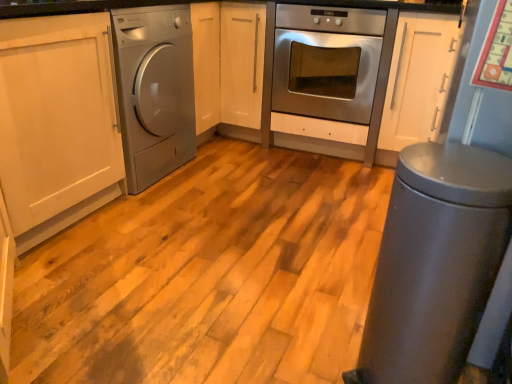
Image resolution: width=512 pixels, height=384 pixels. In order to click on white matte cabinet at center in this screenshot , I will do `click(228, 64)`.

Does metallic gray trash can at lower right turn towards white matte cabinet at center?

No, metallic gray trash can at lower right is not facing towards white matte cabinet at center.

Is metallic gray trash can at lower right far away from white matte cabinet at center?

metallic gray trash can at lower right is positioned a significant distance from white matte cabinet at center.

You are a GUI agent. You are given a task and a screenshot of the screen. Output one action in this format:
    pyautogui.click(x=<x>, y=<y>)
    Task: Click on the gray on the right of white matte cabinet at center
    Image resolution: width=512 pixels, height=384 pixels.
    Given the screenshot: What is the action you would take?
    pyautogui.click(x=435, y=263)

Which is more to the left, metallic gray trash can at lower right or white matte cabinet at center?

Positioned to the left is white matte cabinet at center.

Which of these two, stainless steel oven at center or satin silver washing machine at left, stands taller?

satin silver washing machine at left is taller.

Is point (365, 68) positioned after point (173, 156)?

No, it is in front of (173, 156).

Can you tell me how much stainless steel oven at center and satin silver washing machine at left differ in facing direction?

90.6 degrees.

Does white matte cabinet at center lie in front of stainless steel oven at center?

No, the depth of white matte cabinet at center is greater than that of stainless steel oven at center.

Could you tell me if white matte cabinet at center is turned towards stainless steel oven at center?

No, white matte cabinet at center is not aimed at stainless steel oven at center.

Who is smaller, white matte cabinet at center or stainless steel oven at center?

With smaller size is stainless steel oven at center.

At what (x,y) coordinates should I click in order to perform the action: click on gray in front of the stainless steel oven at center. Please return your answer as a coordinate pair (x, y). The height and width of the screenshot is (384, 512). Looking at the image, I should click on (435, 263).

Which is more to the left, metallic gray trash can at lower right or stainless steel oven at center?

metallic gray trash can at lower right is more to the left.

Is the position of metallic gray trash can at lower right more distant than that of stainless steel oven at center?

No, metallic gray trash can at lower right is in front of stainless steel oven at center.

From a real-world perspective, is satin silver washing machine at left located higher than stainless steel oven at center?

Yes, from a real-world perspective, satin silver washing machine at left is on top of stainless steel oven at center.

Who is more distant, satin silver washing machine at left or stainless steel oven at center?

satin silver washing machine at left is behind.

Is point (181, 23) more distant than point (366, 18)?

That is False.

Between satin silver washing machine at left and stainless steel oven at center, which one has more height?

With more height is satin silver washing machine at left.

Could you tell me if stainless steel oven at center is facing metallic gray trash can at lower right?

Yes, stainless steel oven at center faces towards metallic gray trash can at lower right.

Which is further, (381, 47) or (394, 285)?

The point (381, 47) is farther from the camera.

Where is `oven behind the metallic gray trash can at lower right`? The image size is (512, 384). oven behind the metallic gray trash can at lower right is located at coordinates (326, 62).

At what (x,y) coordinates should I click in order to perform the action: click on cabinetry that appears on the right of satin silver washing machine at left. Please return your answer as a coordinate pair (x, y). Image resolution: width=512 pixels, height=384 pixels. Looking at the image, I should click on (228, 64).

From a real-world perspective, who is located higher, white matte cabinet at center or satin silver washing machine at left?

From a 3D spatial view, white matte cabinet at center is above.

Is white matte cabinet at center next to satin silver washing machine at left?

No, white matte cabinet at center is not with satin silver washing machine at left.

Between white matte cabinet at center and satin silver washing machine at left, which one has larger size?

white matte cabinet at center is bigger.

Locate an element on the screen. cabinetry located on the left of metallic gray trash can at lower right is located at coordinates (228, 64).

Locate an element on the screen. This screenshot has width=512, height=384. oven that is below the satin silver washing machine at left (from the image's perspective) is located at coordinates (326, 62).

Considering their positions, is white matte cabinet at center positioned closer to satin silver washing machine at left than metallic gray trash can at lower right?

white matte cabinet at center is positioned closer to the anchor satin silver washing machine at left.

Considering their positions, is satin silver washing machine at left positioned closer to stainless steel oven at center than metallic gray trash can at lower right?

Answer: Based on the image, satin silver washing machine at left appears to be nearer to stainless steel oven at center.

Looking at the image, which one is located further to stainless steel oven at center, metallic gray trash can at lower right or satin silver washing machine at left?

Based on the image, metallic gray trash can at lower right appears to be further to stainless steel oven at center.

Considering their positions, is metallic gray trash can at lower right positioned closer to satin silver washing machine at left than white matte cabinet at center?

white matte cabinet at center.

Consider the image. When comparing their distances from white matte cabinet at center, does metallic gray trash can at lower right or satin silver washing machine at left seem further?

metallic gray trash can at lower right lies further to white matte cabinet at center than the other object.

Estimate the real-world distances between objects in this image. Which object is closer to satin silver washing machine at left, metallic gray trash can at lower right or stainless steel oven at center?

stainless steel oven at center is closer to satin silver washing machine at left.

When comparing their distances from stainless steel oven at center, does metallic gray trash can at lower right or white matte cabinet at center seem further?

metallic gray trash can at lower right is positioned further to the anchor stainless steel oven at center.

When comparing their distances from white matte cabinet at center, does metallic gray trash can at lower right or stainless steel oven at center seem further?

Based on the image, metallic gray trash can at lower right appears to be further to white matte cabinet at center.

In order to click on oven between metallic gray trash can at lower right and satin silver washing machine at left in the front-back direction in this screenshot , I will do `click(326, 62)`.

Where is `cabinetry between satin silver washing machine at left and stainless steel oven at center from left to right`? cabinetry between satin silver washing machine at left and stainless steel oven at center from left to right is located at coordinates (228, 64).

What are the coordinates of `oven located between metallic gray trash can at lower right and white matte cabinet at center in the depth direction` in the screenshot? It's located at (326, 62).

The width and height of the screenshot is (512, 384). Find the location of `home appliance between metallic gray trash can at lower right and white matte cabinet at center along the z-axis`. home appliance between metallic gray trash can at lower right and white matte cabinet at center along the z-axis is located at coordinates point(154,90).